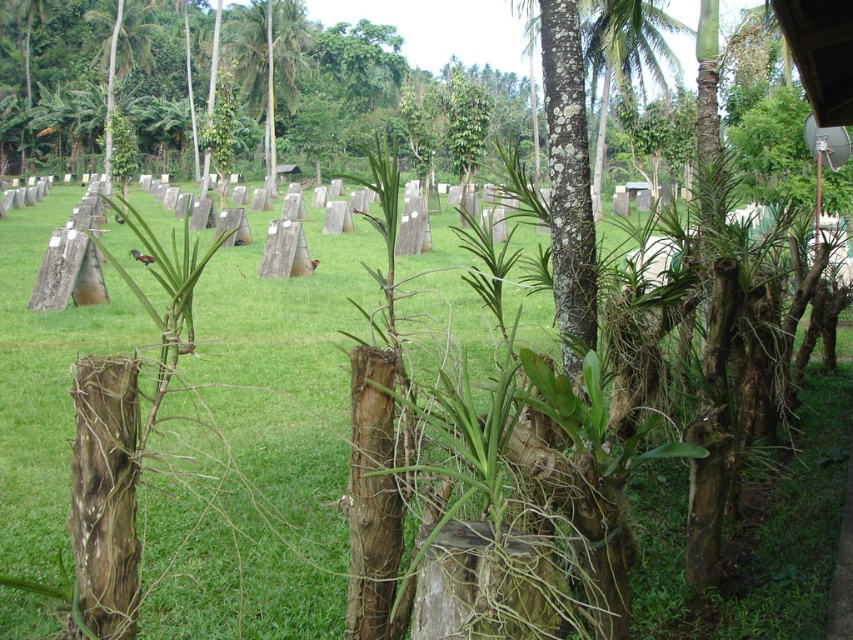
You are a landscape architect designing a walking path between the green grass at center and the green leafy palm tree at upper left. What is the minimum length of the path required to connect these two areas?

The minimum length of the path required to connect the green grass at center and the green leafy palm tree at upper left is 27.16 meters, as they are 27.16 meters apart from each other.

You are planning to place a small garden statue that is 1 meter wide in the center of the green grass at center. Based on the scene, will the statue fit comfortably without overlapping the green leafy palm tree at upper left?

The green grass at center might be wider than green leafy palm tree at upper left, so the statue may fit, but there is uncertainty due to the possible width comparison between the grass area and the palm tree.